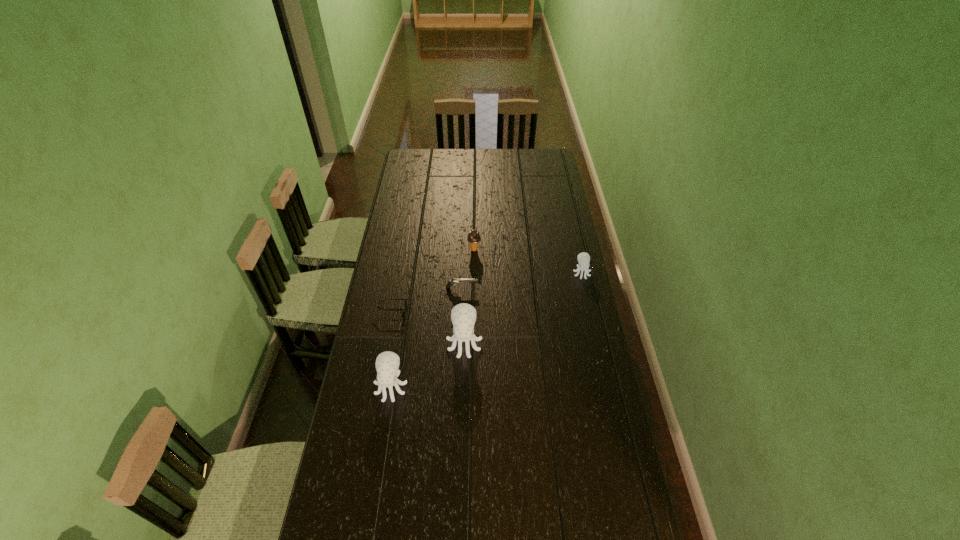
Please determine a free point for an extra octopus_(food) to ensure balance. Please provide its 2D coordinates. Your answer should be formatted as a tuple, i.e. [(x, y)], where the tuple contains the x and y coordinates of a point satisfying the conditions above.

[(527, 305)]